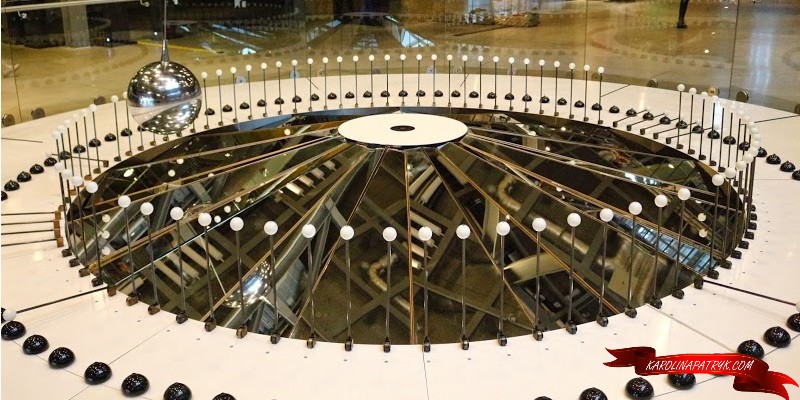
Locate an element on the screen. This screenshot has height=400, width=800. glass is located at coordinates (678, 47).